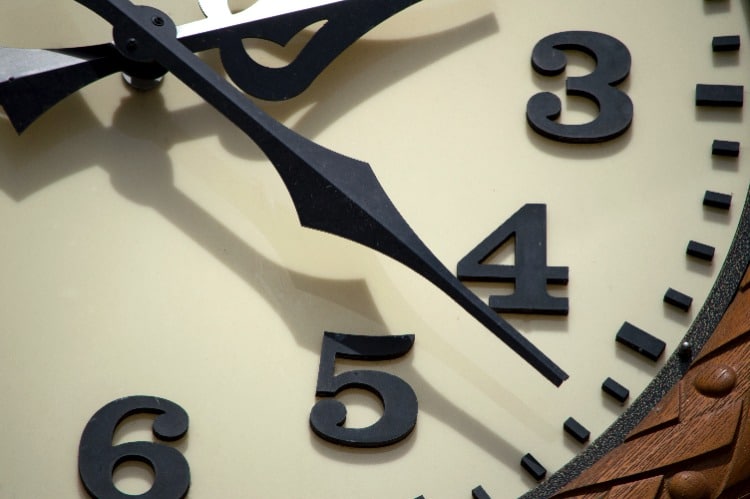
What are the coordinates of `corner of a clock` in the screenshot? It's located at (69, 482), (717, 37), (42, 37).